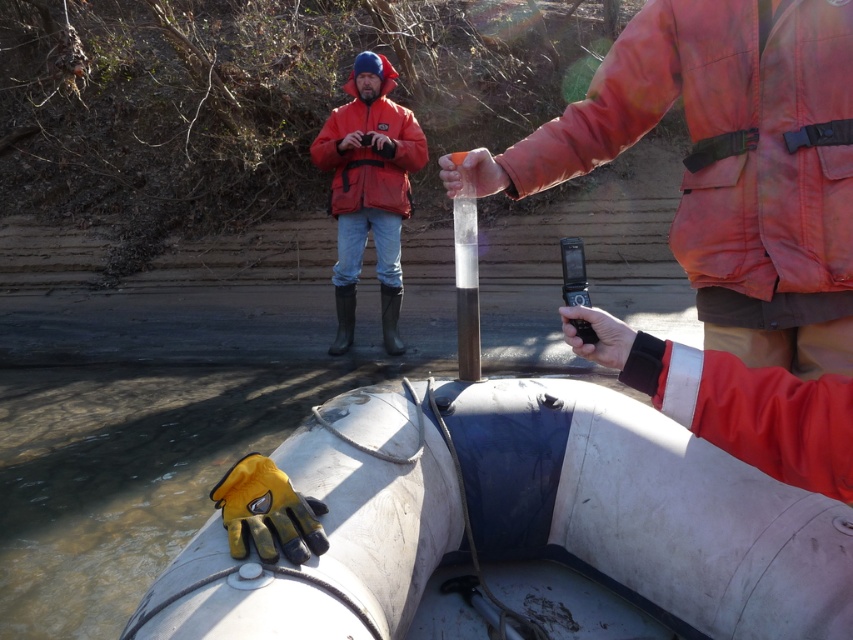
Question: Can you confirm if white rubber boat at lower center is positioned to the right of matte orange jacket at center?

Choices:
 (A) no
 (B) yes

Answer: (B)

Question: Which object is positioned closest to the orange matte jacket at upper right?

Choices:
 (A) matte orange jacket at center
 (B) white rubber boat at lower center

Answer: (B)

Question: Estimate the real-world distances between objects in this image. Which object is farther from the matte orange jacket at center?

Choices:
 (A) orange matte jacket at upper right
 (B) white rubber boat at lower center

Answer: (A)

Question: Is orange matte jacket at upper right positioned in front of matte orange jacket at center?

Choices:
 (A) yes
 (B) no

Answer: (A)

Question: Does white rubber boat at lower center appear under orange matte jacket at upper right?

Choices:
 (A) yes
 (B) no

Answer: (A)

Question: Which object is the closest to the white rubber boat at lower center?

Choices:
 (A) matte orange jacket at center
 (B) orange matte jacket at upper right

Answer: (B)